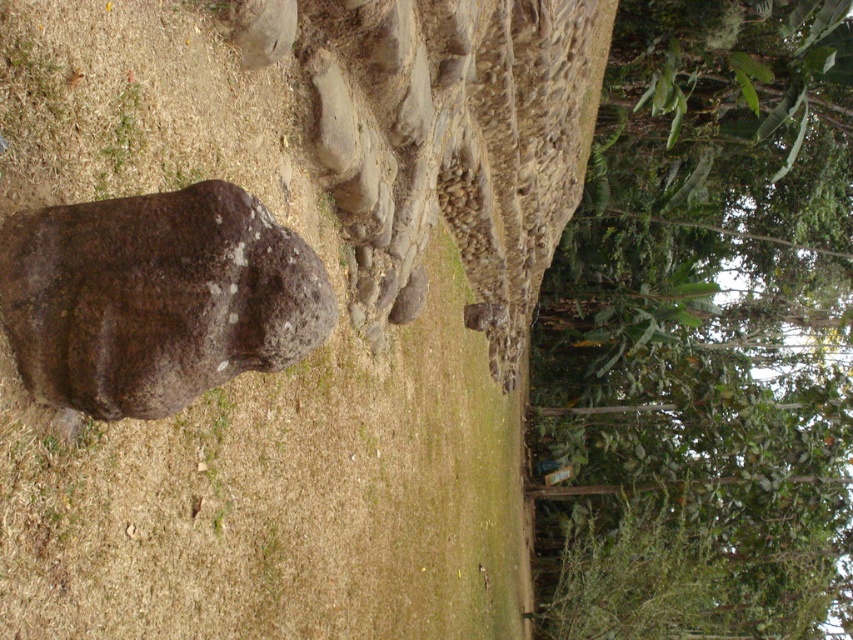
Can you confirm if green leafy tree at upper right is shorter than brown rough stone at center?

Incorrect, green leafy tree at upper right's height does not fall short of brown rough stone at center's.

Measure the distance between point (746, 218) and camera.

A distance of 27.52 meters exists between point (746, 218) and camera.

Which is in front, point (825, 344) or point (103, 246)?

Point (103, 246) is more forward.

The height and width of the screenshot is (640, 853). I want to click on green leafy tree at upper right, so click(x=703, y=333).